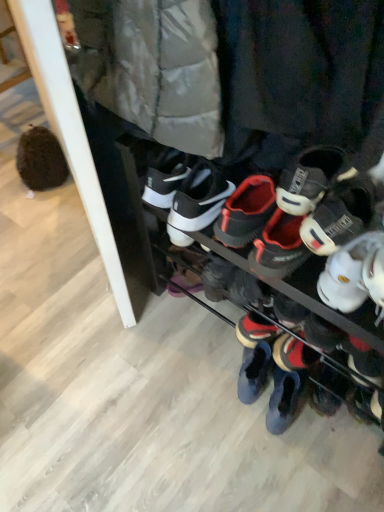
Question: Is black matte sneakers at center, which is counted as the third footwear, starting from the back, oriented towards white matte sneaker at right, which is counted as the second footwear, starting from the front?

Choices:
 (A) no
 (B) yes

Answer: (A)

Question: Is the position of black matte sneakers at center, which is counted as the third footwear, starting from the back, less distant than that of white matte sneaker at right, acting as the second footwear starting from the back?

Choices:
 (A) no
 (B) yes

Answer: (B)

Question: Is black matte sneakers at center, the first footwear in the front-to-back sequence, completely or partially outside of white matte sneaker at right, which is counted as the second footwear, starting from the front?

Choices:
 (A) no
 (B) yes

Answer: (B)

Question: Can you confirm if black matte sneakers at center, which is counted as the third footwear, starting from the back, is bigger than white matte sneaker at right, which is counted as the second footwear, starting from the front?

Choices:
 (A) no
 (B) yes

Answer: (B)

Question: From the image's perspective, does black matte sneakers at center, the first footwear in the front-to-back sequence, appear lower than white matte sneaker at right, acting as the second footwear starting from the back?

Choices:
 (A) no
 (B) yes

Answer: (B)

Question: From a real-world perspective, is black matte sneakers at center, the first footwear in the front-to-back sequence, located higher than white matte sneaker at right, acting as the second footwear starting from the back?

Choices:
 (A) yes
 (B) no

Answer: (B)

Question: Can you confirm if white matte sneaker at right, which is counted as the second footwear, starting from the front, is taller than black suede sneaker at lower right, the third footwear from the front?

Choices:
 (A) yes
 (B) no

Answer: (A)

Question: From the image's perspective, would you say white matte sneaker at right, which is counted as the second footwear, starting from the front, is positioned over black suede sneaker at lower right, the third footwear from the front?

Choices:
 (A) no
 (B) yes

Answer: (B)

Question: Is white matte sneaker at right, acting as the second footwear starting from the back, looking in the opposite direction of black suede sneaker at lower right, which is the first footwear in back-to-front order?

Choices:
 (A) yes
 (B) no

Answer: (B)

Question: Considering the relative sizes of white matte sneaker at right, which is counted as the second footwear, starting from the front, and black suede sneaker at lower right, which is the first footwear in back-to-front order, in the image provided, is white matte sneaker at right, which is counted as the second footwear, starting from the front, wider than black suede sneaker at lower right, which is the first footwear in back-to-front order,?

Choices:
 (A) yes
 (B) no

Answer: (A)

Question: Is white matte sneaker at right, acting as the second footwear starting from the back, closer to the viewer compared to black suede sneaker at lower right, the third footwear from the front?

Choices:
 (A) no
 (B) yes

Answer: (B)

Question: Is white matte sneaker at right, which is counted as the second footwear, starting from the front, not inside black suede sneaker at lower right, the third footwear from the front?

Choices:
 (A) yes
 (B) no

Answer: (A)

Question: From a real-world perspective, does black matte sneakers at center, the first footwear in the front-to-back sequence, stand above black suede sneaker at lower right, the third footwear from the front?

Choices:
 (A) yes
 (B) no

Answer: (A)